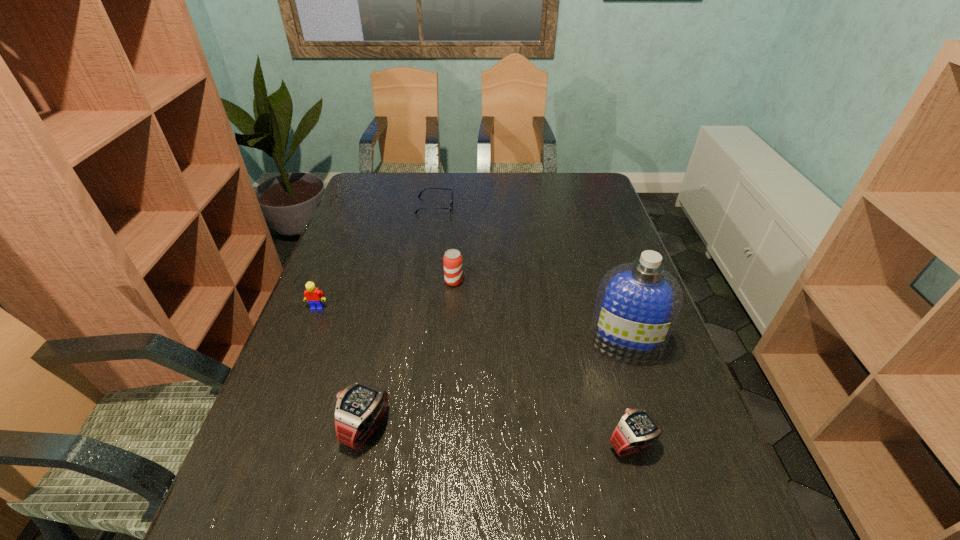
In the image, there is a desktop. Identify the location of vacant space at the far edge. The width and height of the screenshot is (960, 540). (426, 198).

Locate an element on the screen. This screenshot has width=960, height=540. vacant space at the near edge of the desktop is located at coordinates (576, 464).

This screenshot has width=960, height=540. In the image, there is a desktop. In order to click on free space at the left edge in this screenshot , I will do `click(273, 423)`.

You are a GUI agent. You are given a task and a screenshot of the screen. Output one action in this format:
    pyautogui.click(x=<x>, y=<y>)
    Task: Click on the free point at the right edge
    The height and width of the screenshot is (540, 960).
    Given the screenshot: What is the action you would take?
    pyautogui.click(x=683, y=438)

Where is `vacant region at the far left corner of the desktop`? The width and height of the screenshot is (960, 540). vacant region at the far left corner of the desktop is located at coordinates (366, 176).

The image size is (960, 540). In order to click on vacant area at the near right corner of the desktop in this screenshot , I will do `click(673, 488)`.

The height and width of the screenshot is (540, 960). I want to click on vacant region between the cleansing agent and the leftmost object, so click(471, 326).

What are the coordinates of `free space between the shortest object and the left watch` in the screenshot? It's located at (400, 316).

The image size is (960, 540). I want to click on vacant point located between the right watch and the third nearest object, so [628, 394].

What are the coordinates of `free spot between the cleansing agent and the beer can` in the screenshot? It's located at (540, 313).